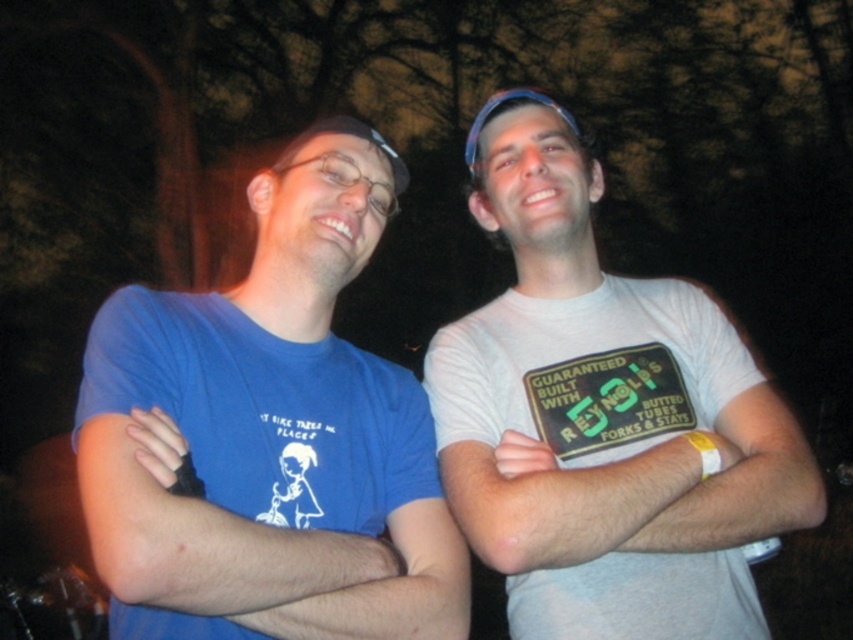
You are a photographer trying to adjust your camera focus. You notice two points in the image at coordinates point (225,616) and point (479,218). Which point should you focus on first to ensure the subject closest to the camera is sharp?

Point (225,616) is in front of point (479,218), so you should focus on point (225,616) first to ensure the subject closest to the camera is sharp.